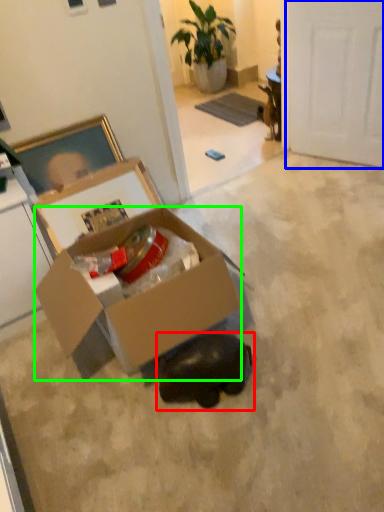
Question: Based on their relative distances, which object is farther from animal (highlighted by a red box)? Choose from door (highlighted by a blue box) and box (highlighted by a green box).

Choices:
 (A) door
 (B) box

Answer: (A)